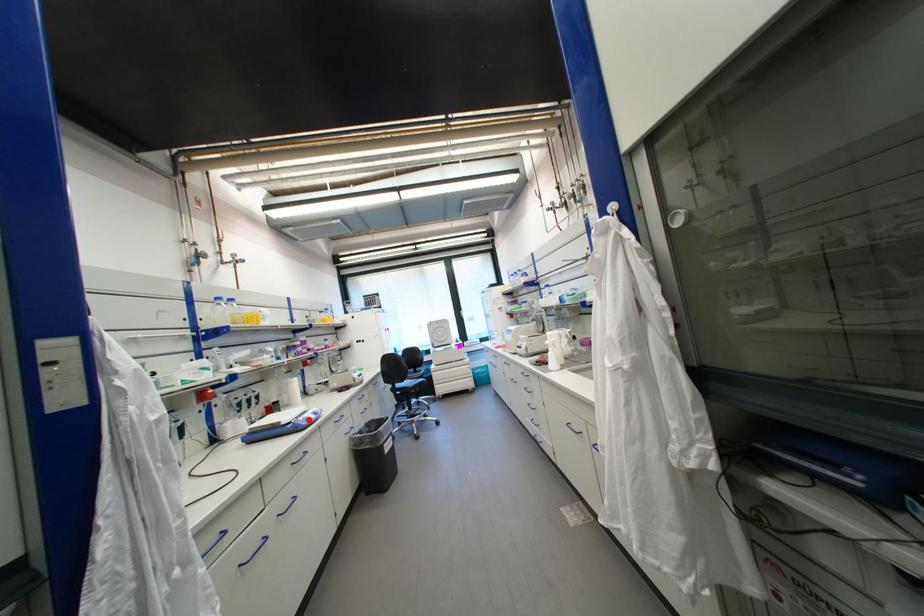
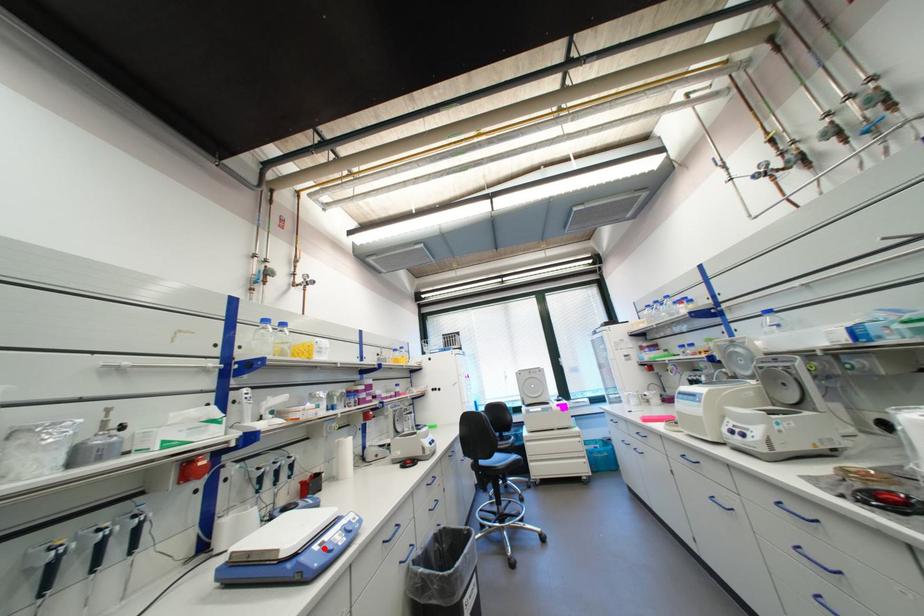
I am providing you with two images of the same scene from different viewpoints. A red point is marked on the first image and another point is marked on the second image. Do the highlighted points in image1 and image2 indicate the same real-world spot?

Yes